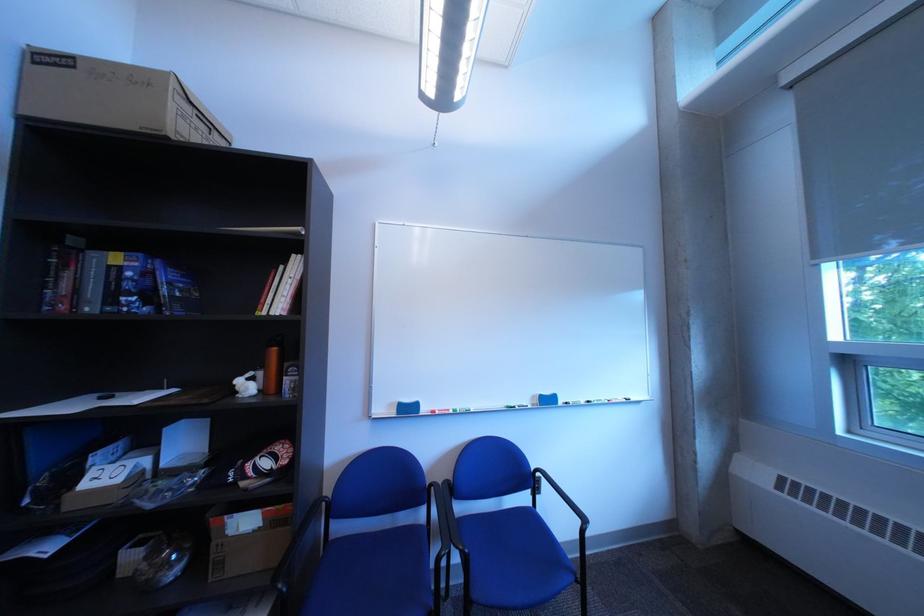
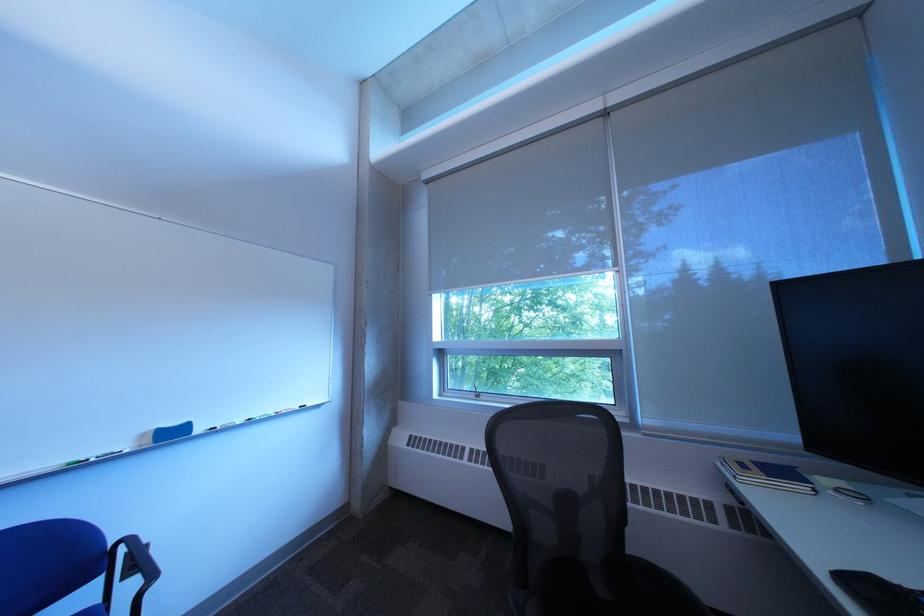
Question: The first image is from the beginning of the video and the second image is from the end. How did the camera likely rotate when shooting the video?

Choices:
 (A) Left
 (B) Right
 (C) Up
 (D) Down

Answer: (B)